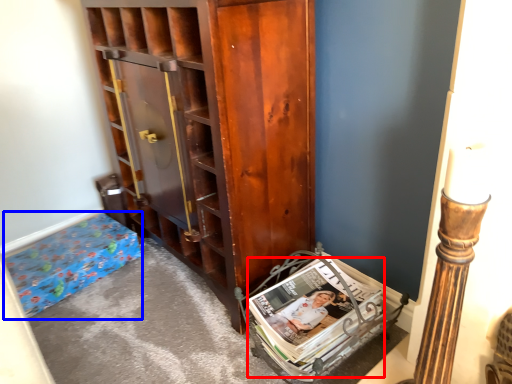
Question: Which of the following is the closest to the observer, magazine (highlighted by a red box) or furniture (highlighted by a blue box)?

Choices:
 (A) magazine
 (B) furniture

Answer: (A)